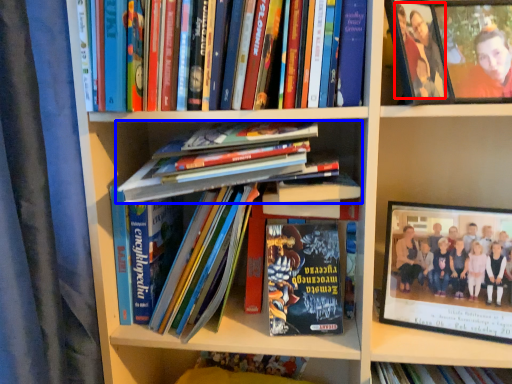
Question: Which object is further to the camera taking this photo, person (highlighted by a red box) or book (highlighted by a blue box)?

Choices:
 (A) person
 (B) book

Answer: (B)